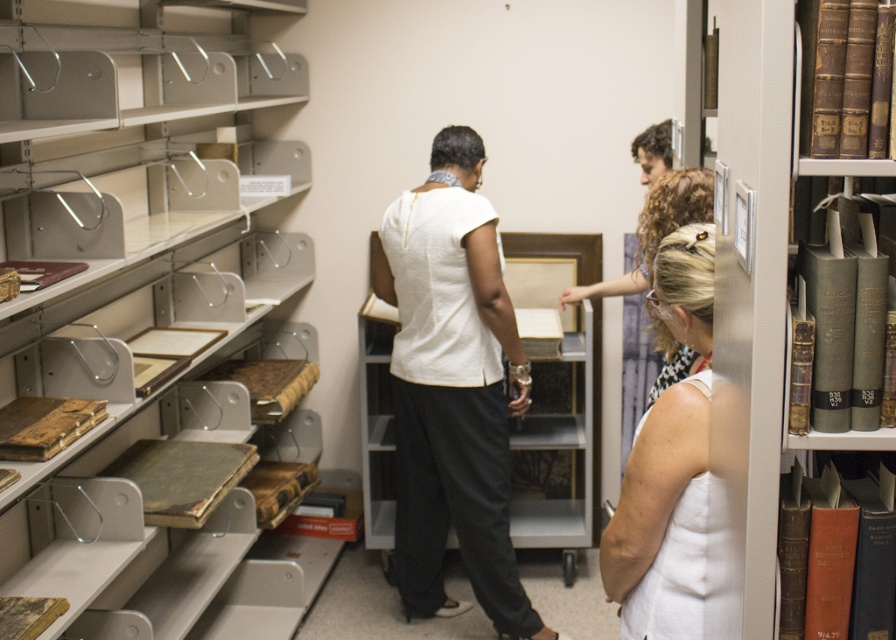
Between matte metal bookcase at left and white matte shirt at center, which one is positioned higher?

Positioned higher is matte metal bookcase at left.

Between matte metal bookcase at left and white matte shirt at center, which one appears on the left side from the viewer's perspective?

matte metal bookcase at left is more to the left.

Is point (134, 13) positioned before point (543, 628)?

Yes, it is.

Locate an element on the screen. This screenshot has width=896, height=640. matte metal bookcase at left is located at coordinates (151, 307).

You are a GUI agent. You are given a task and a screenshot of the screen. Output one action in this format:
    pyautogui.click(x=<x>, y=<y>)
    Task: Click on the matte metal bookcase at left
    The width and height of the screenshot is (896, 640).
    Given the screenshot: What is the action you would take?
    pyautogui.click(x=151, y=307)

Which is more to the right, green leather books at right or white fabric dress at center?

green leather books at right

Is point (776, 488) positioned before point (694, 314)?

That is True.

Locate an element on the screen. This screenshot has height=640, width=896. green leather books at right is located at coordinates (757, 292).